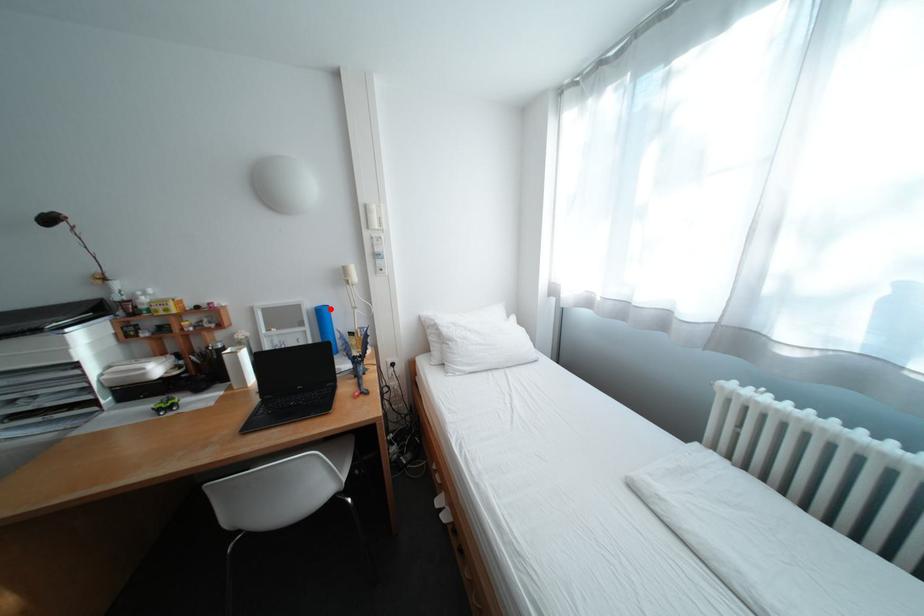
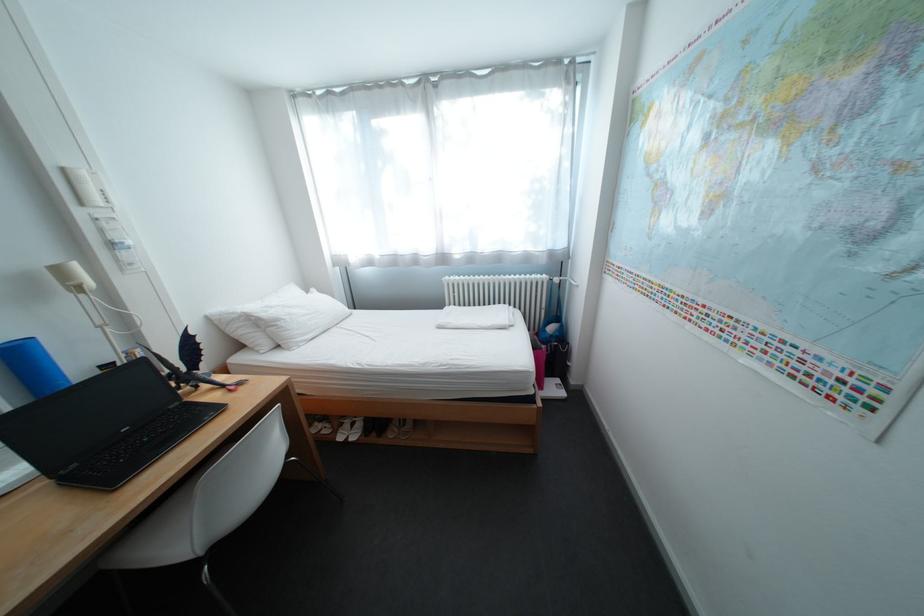
The point at the highlighted location is marked in the first image. Where is the corresponding point in the second image?

(17, 347)